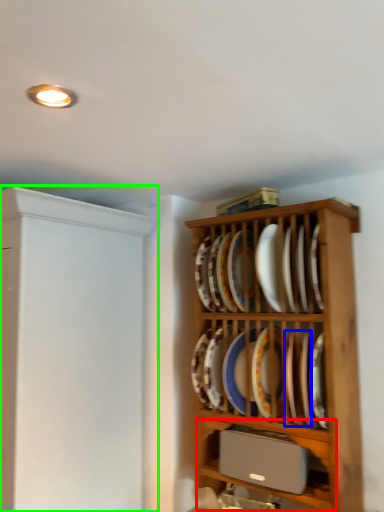
Question: Which object is positioned closest to shelf (highlighted by a red box)? Select from platter (highlighted by a blue box) and cabinetry (highlighted by a green box).

Choices:
 (A) platter
 (B) cabinetry

Answer: (A)